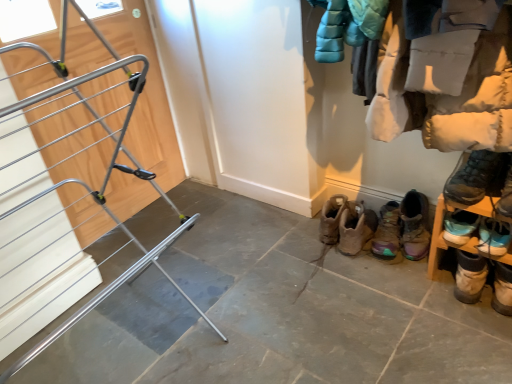
Find the location of a particular element. free space that is in between silver metallic drying rack at left and brown suede boot at lower right, which is counted as the sixth footwear, starting from the right is located at coordinates (257, 291).